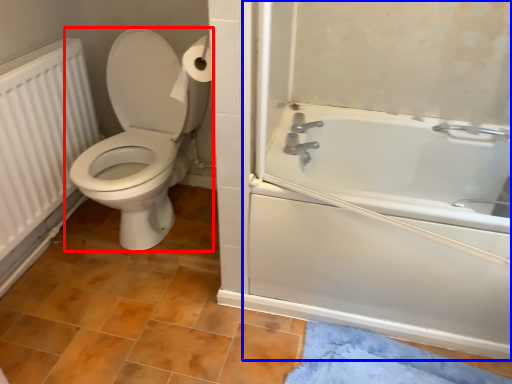
Question: Which object appears closest to the camera in this image, toilet (highlighted by a red box) or screen door (highlighted by a blue box)?

Choices:
 (A) toilet
 (B) screen door

Answer: (B)